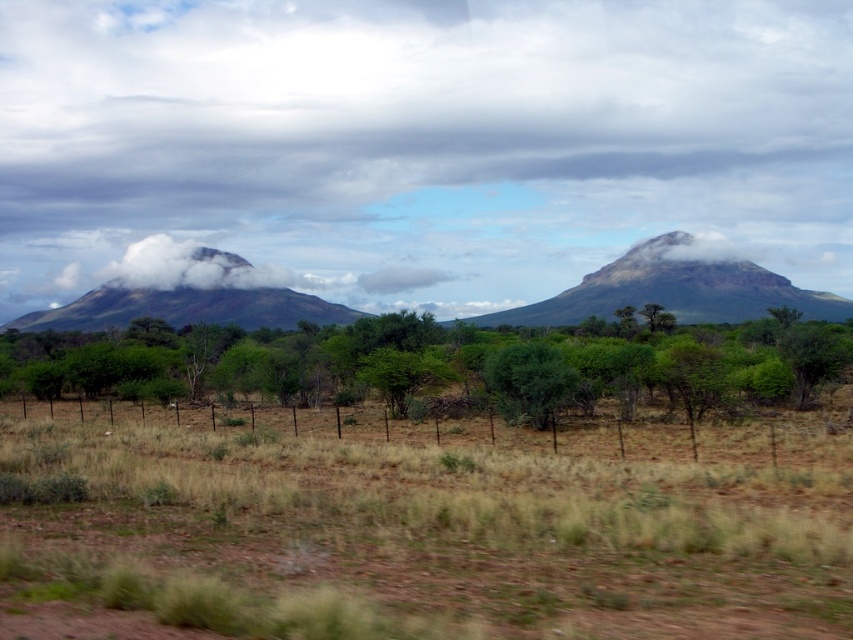
Question: Does rugged brown mountain at center appear on the right side of white fluffy cloud at left?

Choices:
 (A) no
 (B) yes

Answer: (B)

Question: Which point is farther to the camera?

Choices:
 (A) (601, 248)
 (B) (293, 326)
 (C) (402, 406)

Answer: (A)

Question: Observing the image, what is the correct spatial positioning of brown grass at center in reference to white fluffy cloud at left?

Choices:
 (A) right
 (B) left

Answer: (A)

Question: Which point is farther to the camera?

Choices:
 (A) (693, 285)
 (B) (115, 300)
 (C) (97, 268)
 (D) (283, 269)

Answer: (C)

Question: Does green leafy shrub at center lie in front of white fluffy cloud at left?

Choices:
 (A) yes
 (B) no

Answer: (A)

Question: Considering the real-world distances, which object is closest to the gray/cloudy mountain at center?

Choices:
 (A) green matte mountain at left
 (B) rugged brown mountain at center
 (C) white fluffy cloud at left

Answer: (B)